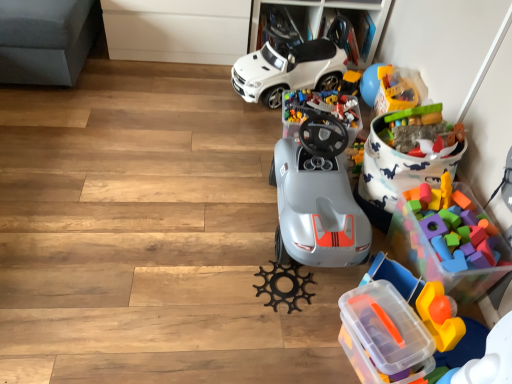
Question: Considering the positions of point (419, 112) and point (404, 271), is point (419, 112) closer or farther from the camera than point (404, 271)?

Choices:
 (A) closer
 (B) farther

Answer: (B)

Question: Considering the positions of rubberized plastic toy at upper right, the 4th toy positioned from the bottom, and translucent plastic blocks at lower right, the 1th toy when ordered from bottom to top, in the image, is rubberized plastic toy at upper right, the 4th toy positioned from the bottom, wider or thinner than translucent plastic blocks at lower right, the 1th toy when ordered from bottom to top,?

Choices:
 (A) wide
 (B) thin

Answer: (A)

Question: Which object is positioned farthest from the gray plastic steering wheel at center, positioned as the 2th toy in top-to-bottom order?

Choices:
 (A) rubberized plastic toy at upper right, the 4th toy positioned from the bottom
 (B) multicolored foam blocks at right, the fourth toy when ordered from top to bottom
 (C) rubberized plastic toy at upper right, positioned as the first toy in top-to-bottom order
 (D) white matte toy car at center
 (E) translucent plastic storage box at lower right

Answer: (E)

Question: Based on their relative distances, which object is nearer to the translucent plastic blocks at lower right, the 1th toy when ordered from bottom to top?

Choices:
 (A) rubberized plastic toy at upper right, marked as the 3th toy in a top-to-bottom arrangement
 (B) multicolored foam blocks at right, the fourth toy when ordered from top to bottom
 (C) rubberized plastic toy at upper right, positioned as the first toy in top-to-bottom order
 (D) translucent plastic storage box at lower right
 (E) white matte toy car at center

Answer: (D)